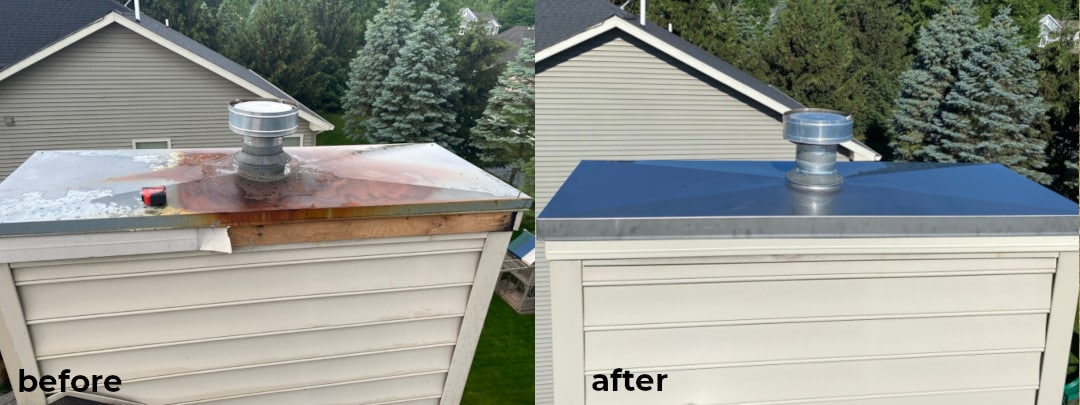
At what (x,y) coordinates should I click in order to perform the action: click on vents. Please return your answer as a coordinate pair (x, y). Looking at the image, I should click on (638, 11), (136, 10), (165, 23), (670, 26).